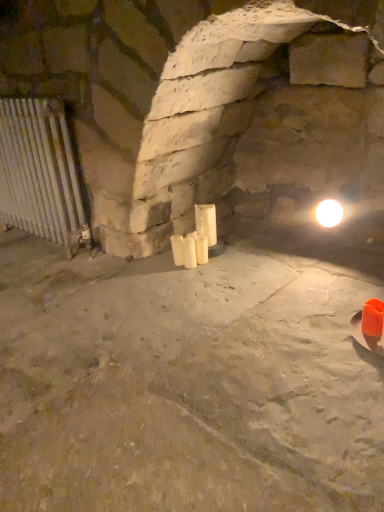
Question: Looking at their shapes, would you say white matte candle at center, the second candle positioned from the left, is wider or thinner than white matte candle at center, the first candle positioned from the left?

Choices:
 (A) wide
 (B) thin

Answer: (A)

Question: Is white matte candle at center, which is the second candle from right to left, taller or shorter than white matte candle at center, the first candle positioned from the left?

Choices:
 (A) short
 (B) tall

Answer: (B)

Question: Considering the real-world distances, which object is farthest from the white matte candle at center, which is counted as the 3th candle, starting from the left?

Choices:
 (A) white matte candle at center, the second candle positioned from the left
 (B) silver metallic radiator at left
 (C) white matte candle at center, which ranks as the 3th candle in right-to-left order

Answer: (B)

Question: Estimate the real-world distances between objects in this image. Which object is closer to the white matte candle at center, which ranks as the first candle in right-to-left order?

Choices:
 (A) white matte candle at center, which is the second candle from right to left
 (B) white matte candle at center, the first candle positioned from the left
 (C) silver metallic radiator at left

Answer: (A)